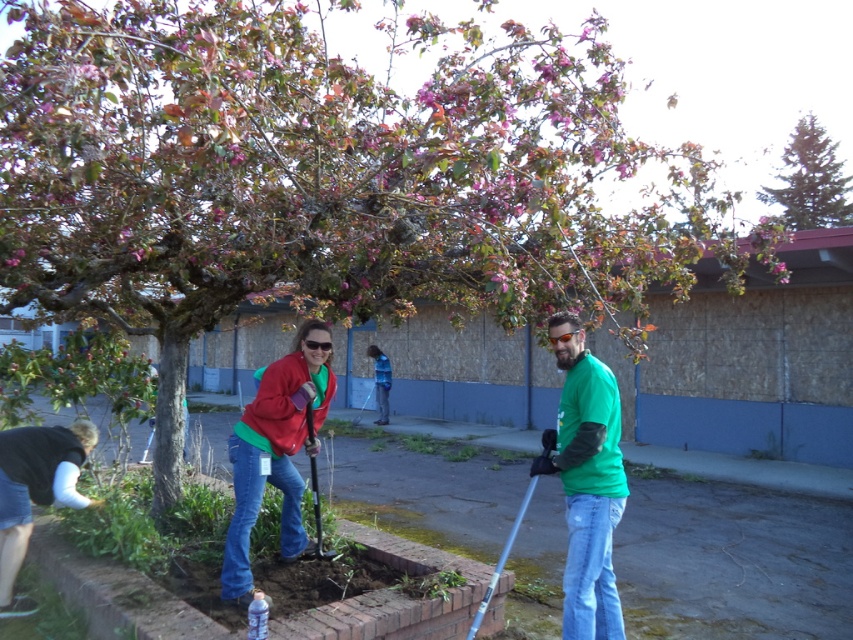
Question: Can you confirm if denim shorts at lower left is positioned above orange reflective goggles at center?

Choices:
 (A) no
 (B) yes

Answer: (A)

Question: Which is nearer to the orange reflective goggles at center?

Choices:
 (A) blue denim jeans at center
 (B) green textured evergreen tree at upper right
 (C) green matte shirt at center
 (D) matte red jacket at center

Answer: (C)

Question: Is metallic silver shovel at center closer to camera compared to blue denim jeans at center?

Choices:
 (A) no
 (B) yes

Answer: (B)

Question: Which point appears farthest from the camera in this image?

Choices:
 (A) (521, 513)
 (B) (795, 160)
 (C) (310, 420)

Answer: (B)

Question: Which object is positioned closest to the metallic silver shovel at center?

Choices:
 (A) denim shorts at lower left
 (B) matte red jacket at center
 (C) green textured evergreen tree at upper right
 (D) blue denim jeans at center

Answer: (B)

Question: Considering the relative positions of denim shorts at lower left and blue denim jeans at center in the image provided, where is denim shorts at lower left located with respect to blue denim jeans at center?

Choices:
 (A) right
 (B) left

Answer: (B)